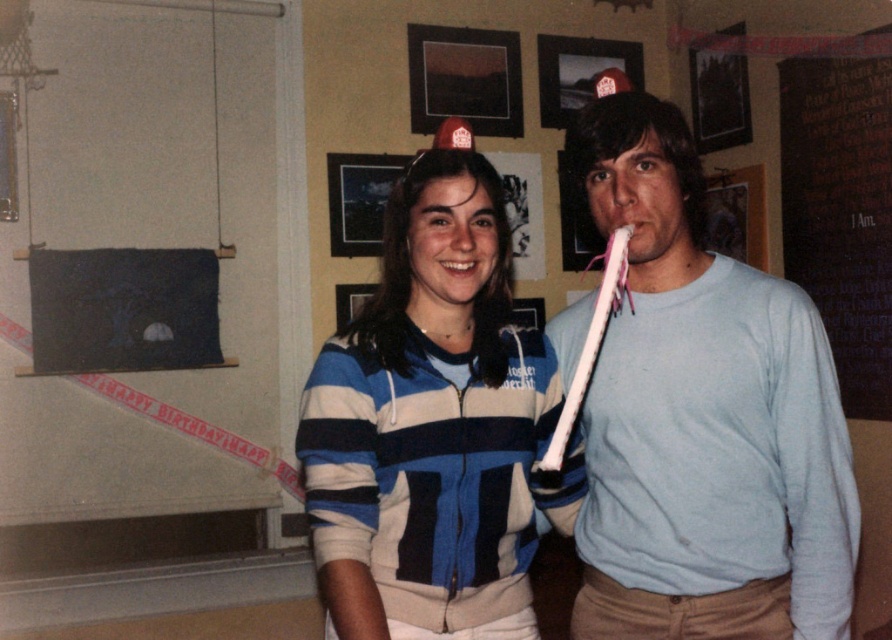
You are standing in front of the wall with framed pictures and need to hang a new picture. You have two nails at coordinates point (583, 413) and point (486, 474). Which nail is closer to you?

Point (583, 413) is further to the viewer than point (486, 474), so the nail at point (583, 413) is closer to you.

You are organizing a clothing donation drive and need to determine which of the two items, the light blue cotton shirt at center or the blue striped hoodie at center, has a wider torso area to accommodate larger body types. Based on the image, which item would you recommend?

The light blue cotton shirt at center has a larger width than the blue striped hoodie at center, making it a better choice for accommodating larger body types.

You are a photographer trying to capture a group photo of the light blue cotton shirt at center and the blue striped hoodie at center. If your camera has a minimum focus distance of 10 inches, will you be able to focus on both subjects simultaneously?

The light blue cotton shirt at center and blue striped hoodie at center are 10.16 inches apart. Since the distance between them is slightly over 10 inches, the camera might struggle to focus on both subjects at the same time due to the narrow depth of field at close ranges.